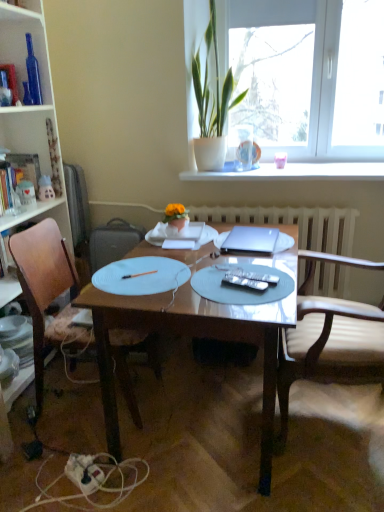
Question: Visually, is satin silver laptop at center positioned to the left or to the right of light brown leather chair at right, the first chair from the right?

Choices:
 (A) left
 (B) right

Answer: (A)

Question: From the image's perspective, is satin silver laptop at center located above or below light brown leather chair at right, the first chair from the right?

Choices:
 (A) below
 (B) above

Answer: (B)

Question: Which object is the farthest from the white matte paper plate at center, the first paper plate in the left-to-right sequence?

Choices:
 (A) matte plastic toy at left, acting as the 2th toy starting from the left
 (B) wooden bookcase at left
 (C) green glossy plant at upper center
 (D) wooden desk at center
 (E) silver metallic remote control at center

Answer: (C)

Question: Based on their relative distances, which object is farther from the wooden desk at center?

Choices:
 (A) satin silver laptop at center
 (B) green glossy plant at upper center
 (C) hardcover book at left
 (D) transparent glass window at upper center
 (E) silver metallic remote control at center

Answer: (D)